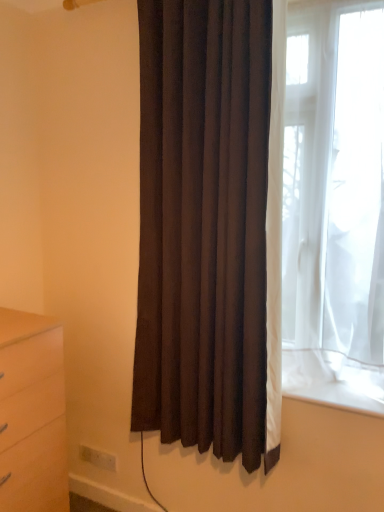
Question: Is point (36, 446) positioned closer to the camera than point (102, 450)?

Choices:
 (A) farther
 (B) closer

Answer: (B)

Question: Considering their positions, is matte wood chest of drawers at lower left located in front of or behind white plastic electric outlet at lower left?

Choices:
 (A) front
 (B) behind

Answer: (A)

Question: Which object is positioned closest to the dark brown fabric curtain at center?

Choices:
 (A) white plastic electric outlet at lower left
 (B) matte wood chest of drawers at lower left

Answer: (B)

Question: Estimate the real-world distances between objects in this image. Which object is closer to the dark brown fabric curtain at center?

Choices:
 (A) matte wood chest of drawers at lower left
 (B) white plastic electric outlet at lower left

Answer: (A)